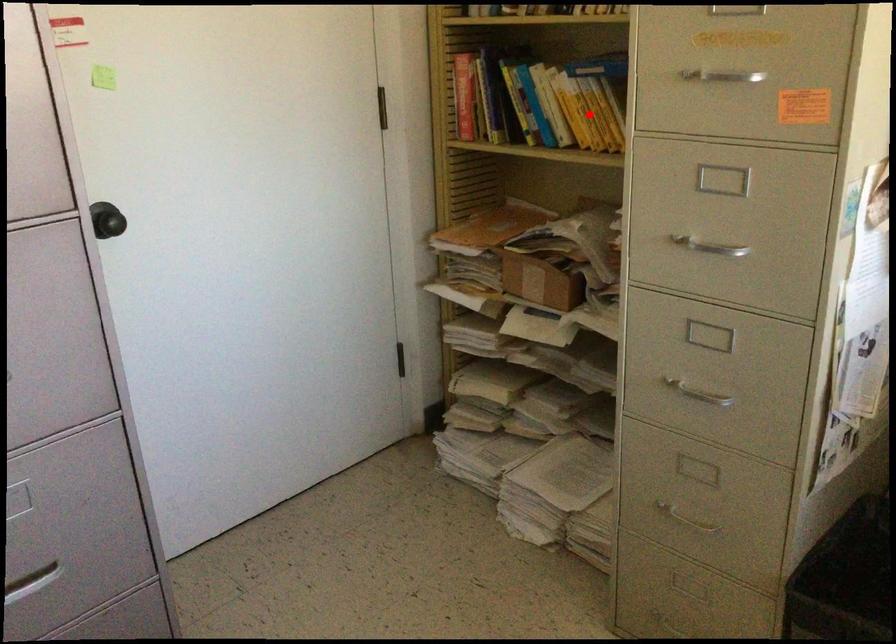
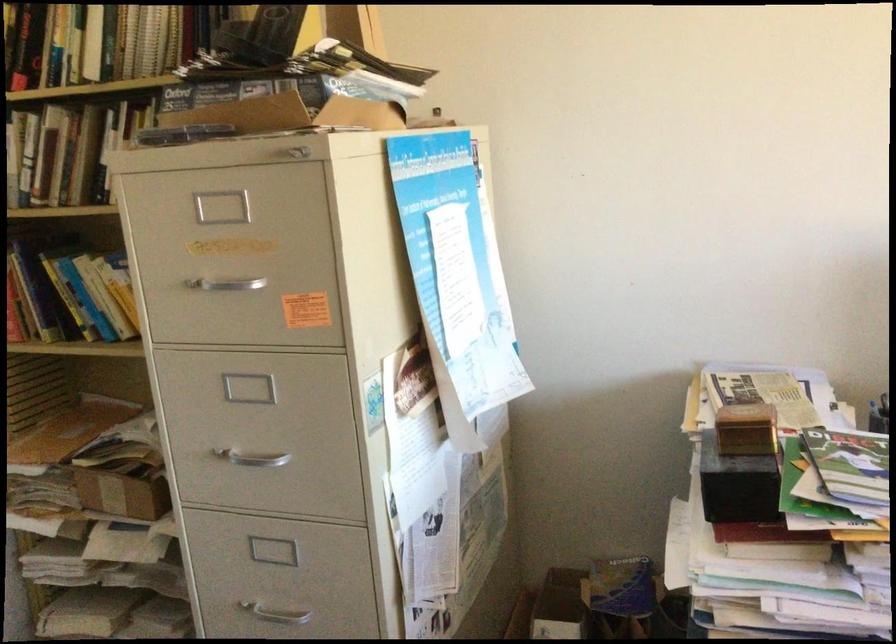
Question: I am providing you with two images of the same scene from different viewpoints. A red point is marked on the first image. Can you still see the location of the red point in image 2?

Choices:
 (A) Yes
 (B) No

Answer: (B)